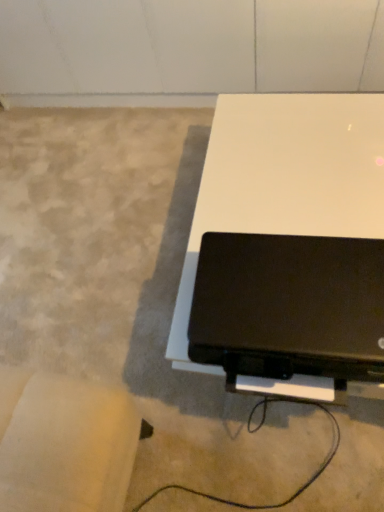
The image size is (384, 512). What do you see at coordinates (284, 180) in the screenshot? I see `white glossy table at center` at bounding box center [284, 180].

This screenshot has width=384, height=512. Identify the location of white glossy table at center. (284, 180).

At what (x,y) coordinates should I click in order to perform the action: click on black matte laptop at lower right. Please return your answer as a coordinate pair (x, y). The image size is (384, 512). Looking at the image, I should click on (289, 306).

Describe the element at coordinates (289, 306) in the screenshot. This screenshot has height=512, width=384. I see `black matte laptop at lower right` at that location.

In order to click on white glossy table at center in this screenshot , I will do `click(284, 180)`.

In the scene shown: In the image, is black matte laptop at lower right on the left side or the right side of white glossy table at center?

Based on their positions, black matte laptop at lower right is located to the left of white glossy table at center.

Which object is further away from the camera taking this photo, black matte laptop at lower right or white glossy table at center?

white glossy table at center is further from the camera.

Which point is more distant from viewer, (245, 352) or (340, 125)?

The point (340, 125) is farther from the camera.

From the image's perspective, which one is positioned lower, black matte laptop at lower right or white glossy table at center?

black matte laptop at lower right is shown below in the image.

Looking at this image, from a real-world perspective, is black matte laptop at lower right positioned above or below white glossy table at center?

From a real-world perspective, black matte laptop at lower right is physically above white glossy table at center.

Considering the sizes of objects black matte laptop at lower right and white glossy table at center in the image provided, who is wider, black matte laptop at lower right or white glossy table at center?

Wider between the two is white glossy table at center.

From their relative heights in the image, would you say black matte laptop at lower right is taller or shorter than white glossy table at center?

Considering their sizes, black matte laptop at lower right has less height than white glossy table at center.

Is black matte laptop at lower right bigger than white glossy table at center?

No, black matte laptop at lower right is not bigger than white glossy table at center.

From the picture: Can we say black matte laptop at lower right lies outside white glossy table at center?

Yes, black matte laptop at lower right is outside of white glossy table at center.

Would you say black matte laptop at lower right is a long distance from white glossy table at center?

Actually, black matte laptop at lower right and white glossy table at center are a little close together.

Is white glossy table at center at the back of black matte laptop at lower right?

No, black matte laptop at lower right is not facing away from white glossy table at center.

How many degrees apart are the facing directions of black matte laptop at lower right and white glossy table at center?

1.12 degrees.

You are a GUI agent. You are given a task and a screenshot of the screen. Output one action in this format:
    pyautogui.click(x=<x>, y=<y>)
    Task: Click on the laptop that is on the left side of white glossy table at center
    The image size is (384, 512).
    Given the screenshot: What is the action you would take?
    pyautogui.click(x=289, y=306)

Which object is positioned more to the left, white glossy table at center or black matte laptop at lower right?

From the viewer's perspective, black matte laptop at lower right appears more on the left side.

Who is more distant, white glossy table at center or black matte laptop at lower right?

Positioned behind is white glossy table at center.

Which point is more forward, (x=203, y=208) or (x=294, y=243)?

The point (x=294, y=243) is more forward.

From the image's perspective, relative to black matte laptop at lower right, is white glossy table at center above or below?

white glossy table at center is situated higher than black matte laptop at lower right in the image.

From a real-world perspective, is white glossy table at center physically above black matte laptop at lower right?

No, from a real-world perspective, white glossy table at center is not on top of black matte laptop at lower right.

Based on the photo, can you confirm if white glossy table at center is thinner than black matte laptop at lower right?

No, white glossy table at center is not thinner than black matte laptop at lower right.

Does white glossy table at center have a lesser height compared to black matte laptop at lower right?

No, white glossy table at center is not shorter than black matte laptop at lower right.

Looking at this image, considering the relative sizes of white glossy table at center and black matte laptop at lower right in the image provided, is white glossy table at center smaller than black matte laptop at lower right?

Actually, white glossy table at center might be larger than black matte laptop at lower right.

Is white glossy table at center outside of black matte laptop at lower right?

Yes.

Is there a large distance between white glossy table at center and black matte laptop at lower right?

No, white glossy table at center is in close proximity to black matte laptop at lower right.

Is white glossy table at center looking in the opposite direction of black matte laptop at lower right?

That's not correct — white glossy table at center is not looking away from black matte laptop at lower right.

How many degrees apart are the facing directions of white glossy table at center and black matte laptop at lower right?

The angular difference between white glossy table at center and black matte laptop at lower right is 1.12 degrees.

You are a GUI agent. You are given a task and a screenshot of the screen. Output one action in this format:
    pyautogui.click(x=<x>, y=<y>)
    Task: Click on the laptop located on the left of white glossy table at center
    The width and height of the screenshot is (384, 512).
    Given the screenshot: What is the action you would take?
    pyautogui.click(x=289, y=306)

Where is `table that appears above the black matte laptop at lower right (from the image's perspective)`? table that appears above the black matte laptop at lower right (from the image's perspective) is located at coordinates (284, 180).

Locate an element on the screen. This screenshot has width=384, height=512. table on the right of the black matte laptop at lower right is located at coordinates (284, 180).